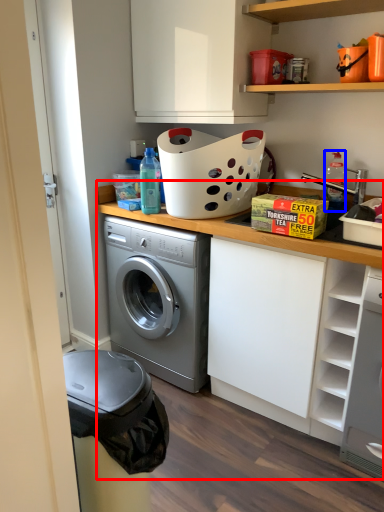
Question: Among these objects, which one is farthest to the camera, counter top (highlighted by a red box) or bottle (highlighted by a blue box)?

Choices:
 (A) counter top
 (B) bottle

Answer: (B)